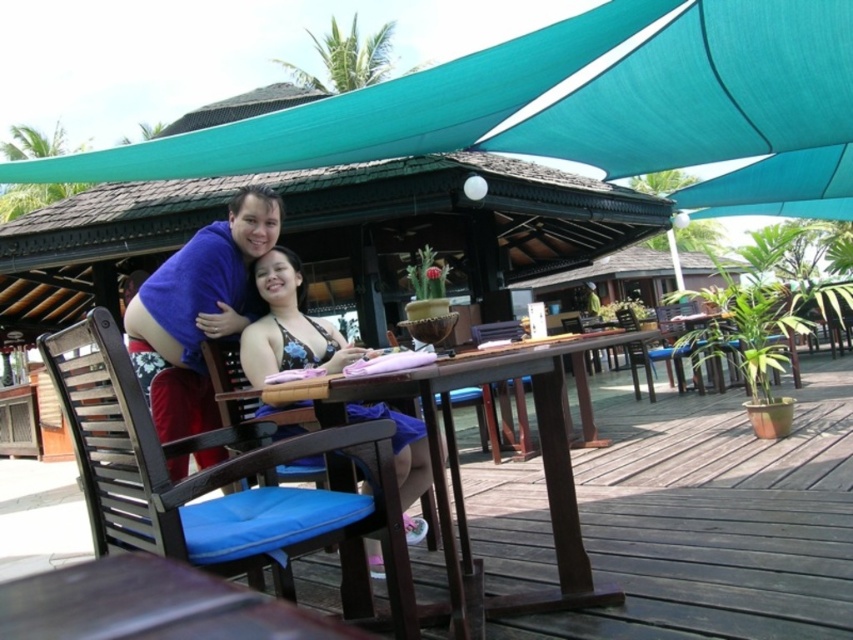
You are a guest at the resort and want to sit down at the brown wooden table at center. Which direction should you face when sitting in the blue padded chair at center to be facing the table?

The blue padded chair at center is in front of the brown wooden table at center, so you should face backward when sitting in the blue padded chair at center to be facing the table.

In the scene shown: You are a guest at this outdoor dining area and want to place a small umbrella on the table between the teal fabric canopy at upper center and the blue padded chair at center. Based on their positions, will the umbrella be closer to the canopy or the chair?

The teal fabric canopy at upper center is further to the viewer than the blue padded chair at center, so the umbrella placed between them would be closer to the chair.